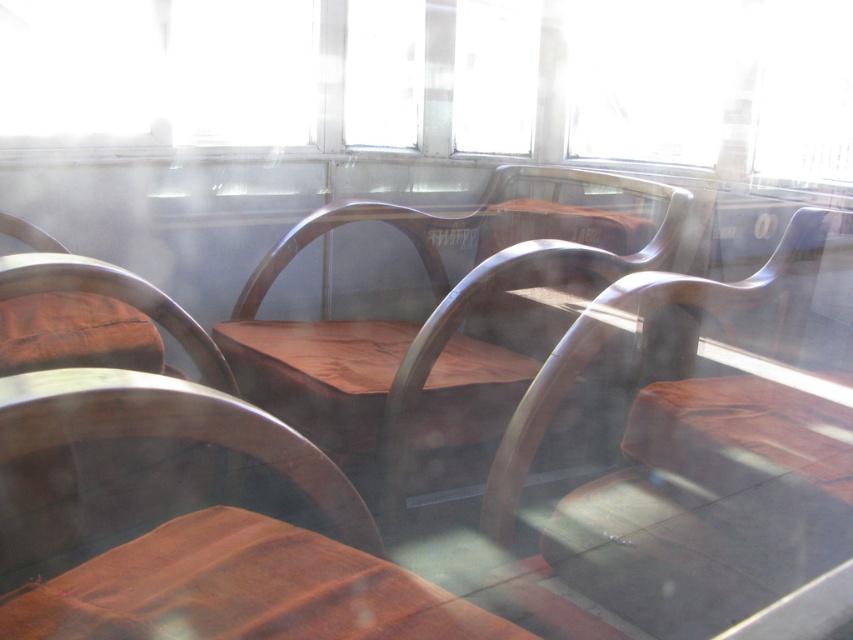
Can you confirm if shiny brown wood chair at center is shorter than wooden polished chair at center?

Yes, shiny brown wood chair at center is shorter than wooden polished chair at center.

Who is lower down, shiny brown wood chair at center or wooden polished chair at center?

shiny brown wood chair at center is lower down.

You are a GUI agent. You are given a task and a screenshot of the screen. Output one action in this format:
    pyautogui.click(x=<x>, y=<y>)
    Task: Click on the shiny brown wood chair at center
    The height and width of the screenshot is (640, 853).
    Given the screenshot: What is the action you would take?
    pyautogui.click(x=218, y=534)

In the scene shown: Is transparent glass window at upper center above brown leather table at lower left?

Yes, transparent glass window at upper center is above brown leather table at lower left.

Does point (173, 26) come farther from viewer compared to point (364, 552)?

Yes.

The height and width of the screenshot is (640, 853). I want to click on transparent glass window at upper center, so click(155, 70).

Which is in front, point (770, 262) or point (241, 54)?

Point (770, 262) is more forward.

Is wooden seat at center taller than transparent glass window at upper center?

Correct, wooden seat at center is much taller as transparent glass window at upper center.

Which is behind, point (639, 300) or point (173, 35)?

Positioned behind is point (173, 35).

Locate an element on the screen. The height and width of the screenshot is (640, 853). wooden seat at center is located at coordinates (700, 452).